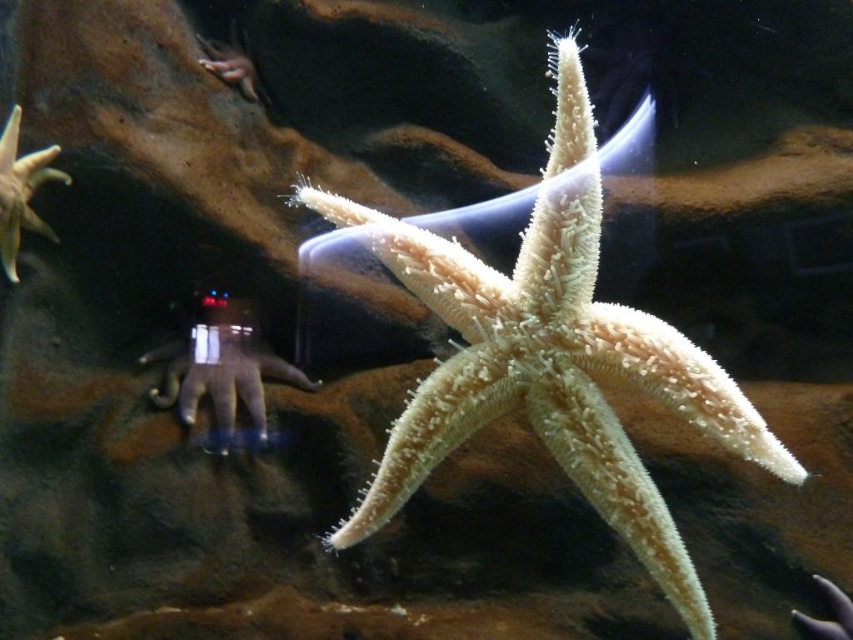
You are a marine biologist observing the underwater scene. You need to retrieve the metallic silver robot at lower center. Which direction should you move relative to the sandy beige starfish at center?

The sandy beige starfish at center is above the metallic silver robot at lower center, so to retrieve the metallic silver robot at lower center, you should move downward from the sandy beige starfish at center.

You are standing at the edge of the aquarium and want to touch the starfish with your finger. The starfish is located at point (720, 436). If your finger can reach up to 4 feet into the water, will you be able to touch the starfish?

The distance of point (720, 436) from viewer is 3.97 feet. Since your finger can reach up to 4 feet, you can just barely touch the starfish at point (720, 436).

You are a marine biologist observing the underwater scene. You notice the sandy beige starfish at center and the metallic silver robot at lower center. Which object is bigger in size?

The sandy beige starfish at center is larger in size compared to the metallic silver robot at lower center.